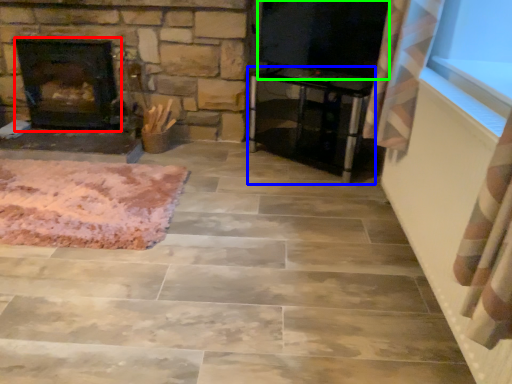
Question: Which is nearer to the fireplace (highlighted by a red box)? furniture (highlighted by a blue box) or window screen (highlighted by a green box).

Choices:
 (A) furniture
 (B) window screen

Answer: (A)